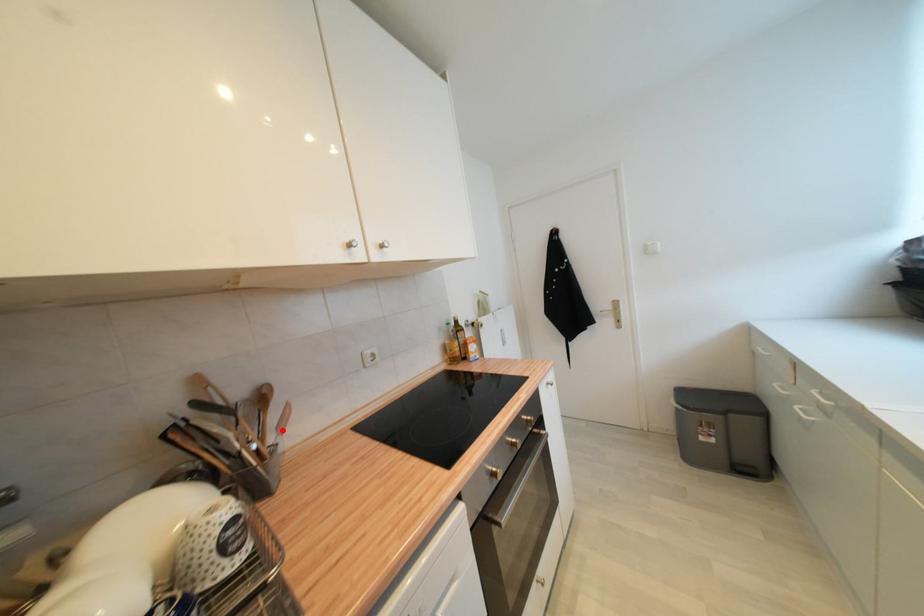
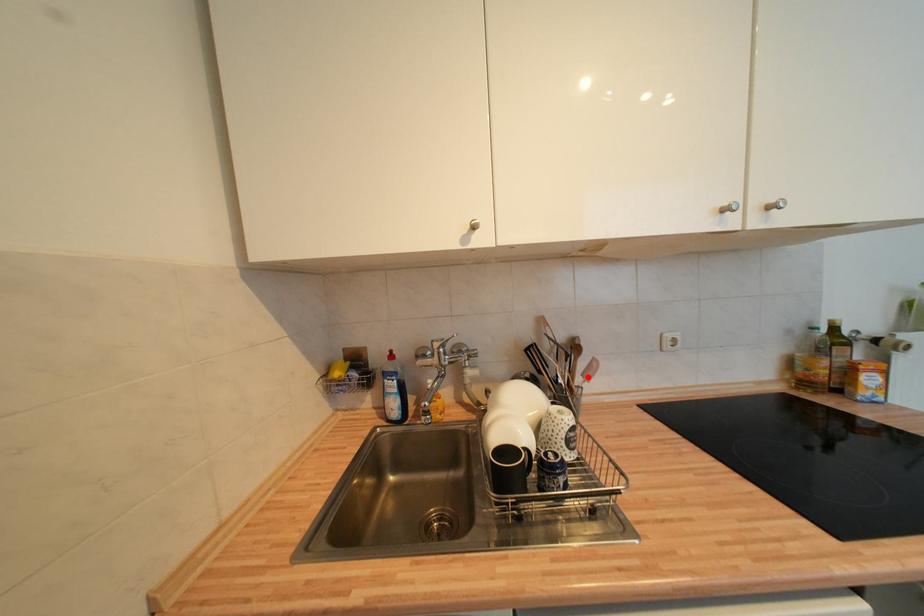
I am providing you with two images of the same scene from different viewpoints. A red point is marked on the first image and another point is marked on the second image. Does the point marked in image1 correspond to the same location as the one in image2?

Yes